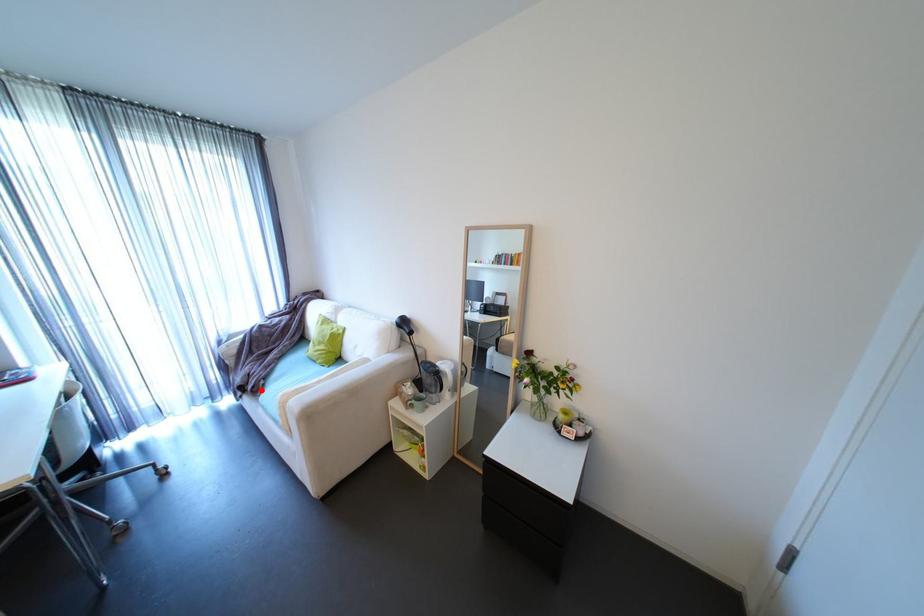
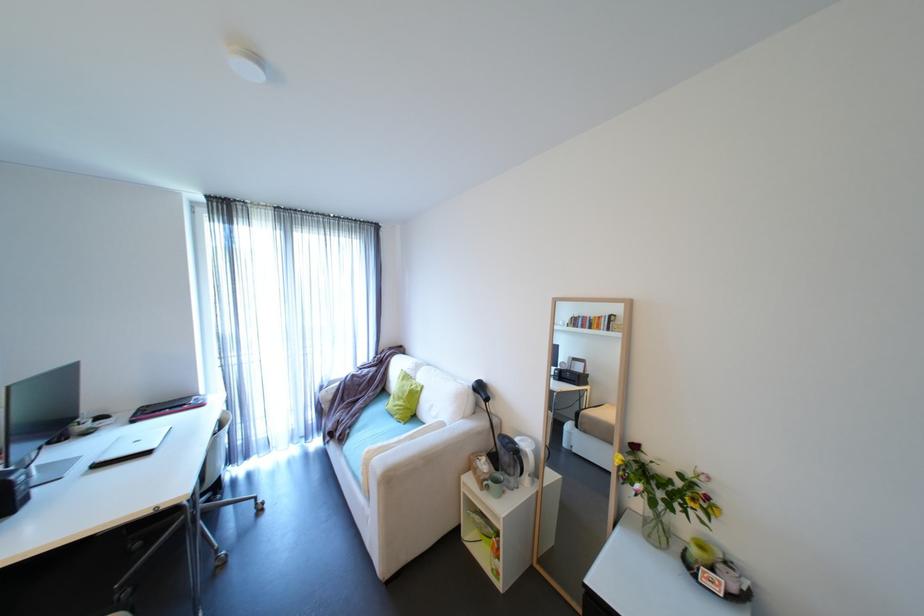
Question: I am providing you with two images of the same scene from different viewpoints. Given a red point in image1, look at the same physical point in image2. Is it:

Choices:
 (A) Closer to the viewpoint
 (B) Farther from the viewpoint

Answer: (B)